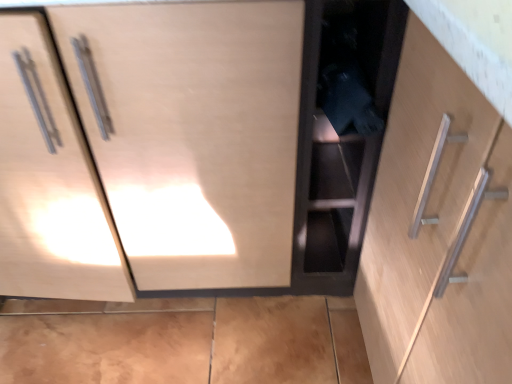
Question: Is matte wood cabinet at center, the 1th cabinetry when ordered from left to right, with black matte cabinet at center, which is the 1th cabinetry from right to left?

Choices:
 (A) yes
 (B) no

Answer: (B)

Question: Is matte wood cabinet at center, the 1th cabinetry when ordered from left to right, bigger than black matte cabinet at center, which is the second cabinetry from left to right?

Choices:
 (A) no
 (B) yes

Answer: (B)

Question: Is matte wood cabinet at center, which appears as the second cabinetry when viewed from the right, at the left side of black matte cabinet at center, which is the second cabinetry from left to right?

Choices:
 (A) no
 (B) yes

Answer: (B)

Question: Is matte wood cabinet at center, which appears as the second cabinetry when viewed from the right, to the right of black matte cabinet at center, which is the second cabinetry from left to right, from the viewer's perspective?

Choices:
 (A) no
 (B) yes

Answer: (A)

Question: Could you tell me if matte wood cabinet at center, the 1th cabinetry when ordered from left to right, is facing black matte cabinet at center, which is the 1th cabinetry from right to left?

Choices:
 (A) no
 (B) yes

Answer: (A)

Question: Is matte wood cabinet at center, which appears as the second cabinetry when viewed from the right, further to the viewer compared to black matte cabinet at center, which is the 1th cabinetry from right to left?

Choices:
 (A) no
 (B) yes

Answer: (A)

Question: Does black matte cabinet at center, which is the second cabinetry from left to right, have a lesser width compared to matte wood cabinet at center, which appears as the second cabinetry when viewed from the right?

Choices:
 (A) no
 (B) yes

Answer: (B)

Question: Is black matte cabinet at center, which is the second cabinetry from left to right, closer to the viewer compared to matte wood cabinet at center, which appears as the second cabinetry when viewed from the right?

Choices:
 (A) yes
 (B) no

Answer: (B)

Question: Is black matte cabinet at center, which is the 1th cabinetry from right to left, outside of matte wood cabinet at center, the 1th cabinetry when ordered from left to right?

Choices:
 (A) yes
 (B) no

Answer: (A)

Question: Can you confirm if black matte cabinet at center, which is the second cabinetry from left to right, is positioned to the right of matte wood cabinet at center, the 1th cabinetry when ordered from left to right?

Choices:
 (A) no
 (B) yes

Answer: (B)

Question: Considering the relative positions of black matte cabinet at center, which is the 1th cabinetry from right to left, and matte wood cabinet at center, which appears as the second cabinetry when viewed from the right, in the image provided, is black matte cabinet at center, which is the 1th cabinetry from right to left, to the left of matte wood cabinet at center, which appears as the second cabinetry when viewed from the right, from the viewer's perspective?

Choices:
 (A) yes
 (B) no

Answer: (B)

Question: Considering the positions of point (90, 114) and point (374, 139), is point (90, 114) closer or farther from the camera than point (374, 139)?

Choices:
 (A) farther
 (B) closer

Answer: (B)